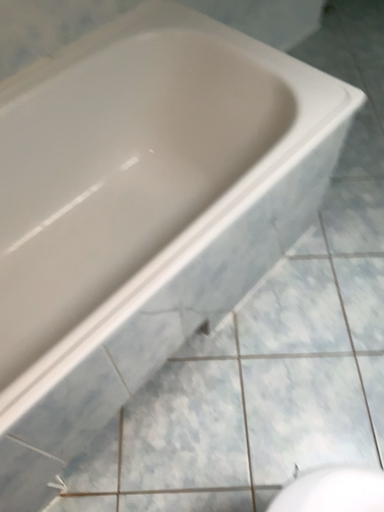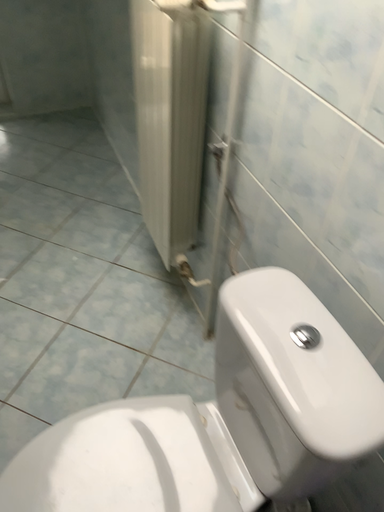
Question: Which way did the camera rotate in the video?

Choices:
 (A) rotated upward
 (B) rotated downward

Answer: (A)